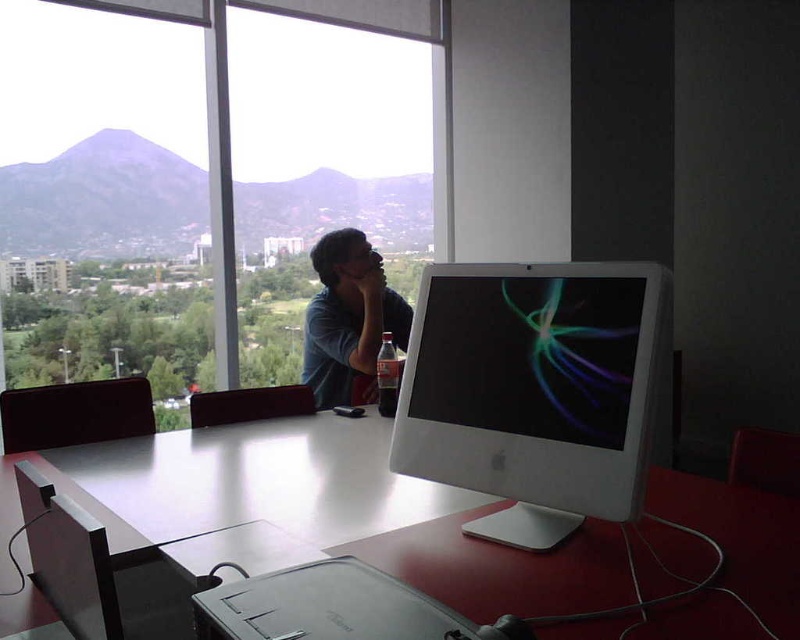
Question: Is white glossy table at center to the left of transparent glass window at center from the viewer's perspective?

Choices:
 (A) yes
 (B) no

Answer: (B)

Question: Can you confirm if transparent glass window at center is positioned above matte blue shirt at center?

Choices:
 (A) no
 (B) yes

Answer: (B)

Question: Estimate the real-world distances between objects in this image. Which object is farther from the white glossy computer monitor at center?

Choices:
 (A) transparent glass window at center
 (B) matte blue shirt at center
 (C) transparent glass window at upper center

Answer: (A)

Question: Which object is closer to the camera taking this photo?

Choices:
 (A) white glossy table at center
 (B) transparent glass window at center

Answer: (A)

Question: Estimate the real-world distances between objects in this image. Which object is farther from the transparent glass window at upper center?

Choices:
 (A) matte blue shirt at center
 (B) transparent glass window at center
 (C) white glossy computer monitor at center
 (D) white glossy table at center

Answer: (C)

Question: Is transparent glass window at upper center behind white glossy computer monitor at center?

Choices:
 (A) no
 (B) yes

Answer: (B)